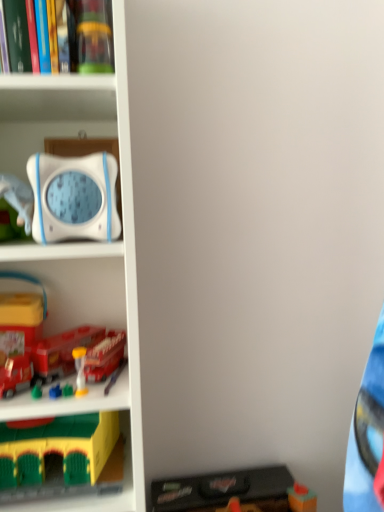
Find the location of `metallic red bus at lower left, the third toy when ordered from left to right`. metallic red bus at lower left, the third toy when ordered from left to right is located at coordinates (105, 357).

You are a GUI agent. You are given a task and a screenshot of the screen. Output one action in this format:
    pyautogui.click(x=<x>, y=<y>)
    Task: Click on the translucent plastic hourglass at lower left, the 2th toy viewed from the top
    This screenshot has height=512, width=384.
    Given the screenshot: What is the action you would take?
    pyautogui.click(x=80, y=370)

What is the approximate width of white plastic bookcase at left?

30.94 centimeters.

The height and width of the screenshot is (512, 384). What do you see at coordinates (234, 492) in the screenshot?
I see `black plastic toy at lower right, which is counted as the first toy, starting from the bottom` at bounding box center [234, 492].

Where is `yellow plastic building block at lower left, which is counted as the second toy, starting from the bottom`? This screenshot has width=384, height=512. yellow plastic building block at lower left, which is counted as the second toy, starting from the bottom is located at coordinates (58, 449).

Image resolution: width=384 pixels, height=512 pixels. What are the coordinates of `metallic red bus at lower left, which is the first toy in top-to-bottom order` in the screenshot? It's located at (105, 357).

Is yellow plastic building block at lower left, acting as the 3th toy starting from the top, in front of or behind hardcover book at upper left in the image?

Clearly, yellow plastic building block at lower left, acting as the 3th toy starting from the top, is behind hardcover book at upper left.

Does yellow plastic building block at lower left, which is counted as the second toy, starting from the bottom, contain hardcover book at upper left?

No, hardcover book at upper left is not surrounded by yellow plastic building block at lower left, which is counted as the second toy, starting from the bottom.

Which object is positioned more to the left, yellow plastic building block at lower left, acting as the 3th toy starting from the top, or hardcover book at upper left?

From the viewer's perspective, yellow plastic building block at lower left, acting as the 3th toy starting from the top, appears more on the left side.

Is yellow plastic building block at lower left, which is counted as the fourth toy, starting from the right, wider or thinner than hardcover book at upper left?

Clearly, yellow plastic building block at lower left, which is counted as the fourth toy, starting from the right, has more width compared to hardcover book at upper left.

Identify the location of the 2nd toy behind the hardcover book at upper left, starting your count from the anchor. The width and height of the screenshot is (384, 512). (80, 370).

Is translucent plastic hourglass at lower left, marked as the 2th toy in a left-to-right arrangement, spatially inside hardcover book at upper left, or outside of it?

translucent plastic hourglass at lower left, marked as the 2th toy in a left-to-right arrangement, lies outside hardcover book at upper left.

Is translucent plastic hourglass at lower left, which appears as the 3th toy when viewed from the right, in front of hardcover book at upper left?

No, translucent plastic hourglass at lower left, which appears as the 3th toy when viewed from the right, is further to the viewer.

From the image's perspective, is translucent plastic hourglass at lower left, the third toy from the bottom, above hardcover book at upper left?

No, from the image's perspective, translucent plastic hourglass at lower left, the third toy from the bottom, is not above hardcover book at upper left.

Between white plastic bookcase at left and hardcover book at upper left, which one has more height?

white plastic bookcase at left.

From a real-world perspective, between white plastic bookcase at left and hardcover book at upper left, who is vertically lower?

From a 3D spatial view, white plastic bookcase at left is below.

Considering the points (103, 84) and (40, 30), which point is behind, point (103, 84) or point (40, 30)?

The point (103, 84) is farther from the camera.

From the picture: Considering the positions of objects white plastic bookcase at left and hardcover book at upper left in the image provided, who is in front, white plastic bookcase at left or hardcover book at upper left?

white plastic bookcase at left.

Looking at this image, from a real-world perspective, is yellow plastic building block at lower left, which is counted as the fourth toy, starting from the right, above or below translucent plastic hourglass at lower left, marked as the 2th toy in a left-to-right arrangement?

In terms of real-world spatial position, yellow plastic building block at lower left, which is counted as the fourth toy, starting from the right, is below translucent plastic hourglass at lower left, marked as the 2th toy in a left-to-right arrangement.

Which is behind, yellow plastic building block at lower left, which is counted as the second toy, starting from the bottom, or translucent plastic hourglass at lower left, the 2th toy viewed from the top?

translucent plastic hourglass at lower left, the 2th toy viewed from the top, is further from the camera.

Is yellow plastic building block at lower left, which is the 1th toy from left to right, wider than translucent plastic hourglass at lower left, marked as the 2th toy in a left-to-right arrangement?

Indeed, yellow plastic building block at lower left, which is the 1th toy from left to right, has a greater width compared to translucent plastic hourglass at lower left, marked as the 2th toy in a left-to-right arrangement.

In the scene shown: Is yellow plastic building block at lower left, which is counted as the second toy, starting from the bottom, bigger than translucent plastic hourglass at lower left, which appears as the 3th toy when viewed from the right?

Yes.

From a real-world perspective, is metallic red bus at lower left, the 4th toy from the bottom, beneath hardcover book at upper left?

Yes, from a real-world perspective, metallic red bus at lower left, the 4th toy from the bottom, is under hardcover book at upper left.

Looking at their sizes, would you say metallic red bus at lower left, the 2th toy positioned from the right, is wider or thinner than hardcover book at upper left?

metallic red bus at lower left, the 2th toy positioned from the right, is wider than hardcover book at upper left.

Is metallic red bus at lower left, the 2th toy positioned from the right, aimed at hardcover book at upper left?

No, metallic red bus at lower left, the 2th toy positioned from the right, does not turn towards hardcover book at upper left.

Is metallic red bus at lower left, the 4th toy from the bottom, not within hardcover book at upper left?

metallic red bus at lower left, the 4th toy from the bottom, lies outside hardcover book at upper left's area.

Does translucent plastic hourglass at lower left, the 2th toy viewed from the top, contain yellow plastic building block at lower left, acting as the 3th toy starting from the top?

No, translucent plastic hourglass at lower left, the 2th toy viewed from the top, does not contain yellow plastic building block at lower left, acting as the 3th toy starting from the top.

Between translucent plastic hourglass at lower left, the third toy from the bottom, and yellow plastic building block at lower left, which is counted as the fourth toy, starting from the right, which one has smaller size?

With smaller size is translucent plastic hourglass at lower left, the third toy from the bottom.

Based on the photo, is translucent plastic hourglass at lower left, which appears as the 3th toy when viewed from the right, in contact with yellow plastic building block at lower left, which is the 1th toy from left to right?

No, translucent plastic hourglass at lower left, which appears as the 3th toy when viewed from the right, is not in contact with yellow plastic building block at lower left, which is the 1th toy from left to right.

From a real-world perspective, is translucent plastic hourglass at lower left, the 2th toy viewed from the top, physically above yellow plastic building block at lower left, acting as the 3th toy starting from the top?

Yes, from a real-world perspective, translucent plastic hourglass at lower left, the 2th toy viewed from the top, is above yellow plastic building block at lower left, acting as the 3th toy starting from the top.

Do you think hardcover book at upper left is within yellow plastic building block at lower left, acting as the 3th toy starting from the top, or outside of it?

hardcover book at upper left cannot be found inside yellow plastic building block at lower left, acting as the 3th toy starting from the top.

From their relative heights in the image, would you say hardcover book at upper left is taller or shorter than yellow plastic building block at lower left, which is counted as the fourth toy, starting from the right?

Clearly, hardcover book at upper left is shorter compared to yellow plastic building block at lower left, which is counted as the fourth toy, starting from the right.

Is hardcover book at upper left in front of or behind yellow plastic building block at lower left, which is the 1th toy from left to right, in the image?

hardcover book at upper left is positioned closer to the viewer than yellow plastic building block at lower left, which is the 1th toy from left to right.

Is hardcover book at upper left oriented towards yellow plastic building block at lower left, acting as the 3th toy starting from the top?

No, hardcover book at upper left is not facing towards yellow plastic building block at lower left, acting as the 3th toy starting from the top.

Locate an element on the screen. toy that is on the left side of hardcover book at upper left is located at coordinates (58, 449).

This screenshot has height=512, width=384. I want to click on book above the translucent plastic hourglass at lower left, the third toy from the bottom (from a real-world perspective), so [17, 35].

In the scene shown: Based on their spatial positions, is black plastic toy at lower right, marked as the 1th toy in a right-to-left arrangement, or yellow plastic building block at lower left, acting as the 3th toy starting from the top, further from white plastic bookcase at left?

Among the two, black plastic toy at lower right, marked as the 1th toy in a right-to-left arrangement, is located further to white plastic bookcase at left.

Estimate the real-world distances between objects in this image. Which object is further from black plastic toy at lower right, which is counted as the first toy, starting from the bottom, translucent plastic hourglass at lower left, marked as the 2th toy in a left-to-right arrangement, or hardcover book at upper left?

hardcover book at upper left.

Looking at the image, which one is located closer to white plastic bookcase at left, hardcover book at upper left or yellow plastic building block at lower left, acting as the 3th toy starting from the top?

yellow plastic building block at lower left, acting as the 3th toy starting from the top.

Estimate the real-world distances between objects in this image. Which object is closer to hardcover book at upper left, translucent plastic hourglass at lower left, marked as the 2th toy in a left-to-right arrangement, or black plastic toy at lower right, marked as the 1th toy in a right-to-left arrangement?

translucent plastic hourglass at lower left, marked as the 2th toy in a left-to-right arrangement.

Looking at the image, which one is located further to translucent plastic hourglass at lower left, the 2th toy viewed from the top, metallic red bus at lower left, the 4th toy from the bottom, or hardcover book at upper left?

hardcover book at upper left.

Looking at the image, which one is located further to yellow plastic building block at lower left, acting as the 3th toy starting from the top, translucent plastic hourglass at lower left, which appears as the 3th toy when viewed from the right, or white plastic bookcase at left?

white plastic bookcase at left.

Considering their positions, is translucent plastic hourglass at lower left, marked as the 2th toy in a left-to-right arrangement, positioned further to metallic red bus at lower left, the 4th toy from the bottom, than hardcover book at upper left?

hardcover book at upper left.

In the scene shown: Based on their spatial positions, is hardcover book at upper left or yellow plastic building block at lower left, acting as the 3th toy starting from the top, closer to black plastic toy at lower right, which is counted as the first toy, starting from the bottom?

yellow plastic building block at lower left, acting as the 3th toy starting from the top.

The width and height of the screenshot is (384, 512). Identify the location of toy between metallic red bus at lower left, the third toy when ordered from left to right, and yellow plastic building block at lower left, which is the 1th toy from left to right, from top to bottom. (80, 370).

Identify the location of toy that lies between hardcover book at upper left and translucent plastic hourglass at lower left, marked as the 2th toy in a left-to-right arrangement, from top to bottom. (105, 357).

Locate an element on the screen. This screenshot has width=384, height=512. bookcase between hardcover book at upper left and yellow plastic building block at lower left, which is counted as the fourth toy, starting from the right, in the up-down direction is located at coordinates (82, 248).

In order to click on toy that lies between translucent plastic hourglass at lower left, the third toy from the bottom, and black plastic toy at lower right, the 4th toy viewed from the left, from top to bottom in this screenshot , I will do `click(58, 449)`.